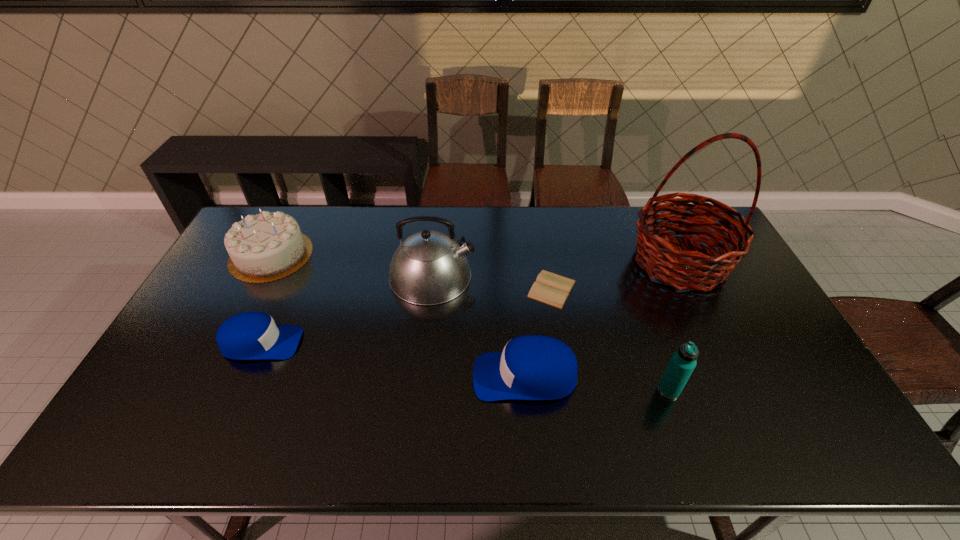
You are a GUI agent. You are given a task and a screenshot of the screen. Output one action in this format:
    pyautogui.click(x=<x>, y=<y>)
    Task: Click on the vacant space positioned 0.220m on the front-facing side of the fifth tallest object
    The height and width of the screenshot is (540, 960).
    Given the screenshot: What is the action you would take?
    390,376

Image resolution: width=960 pixels, height=540 pixels. Find the location of `free spot located 0.150m on the front-facing side of the fifth tallest object`. free spot located 0.150m on the front-facing side of the fifth tallest object is located at coordinates (417, 376).

I want to click on free space located on the front-facing side of the fifth tallest object, so click(382, 376).

Where is `blank space located on the handle side of the basket`? The width and height of the screenshot is (960, 540). blank space located on the handle side of the basket is located at coordinates (722, 350).

You are a GUI agent. You are given a task and a screenshot of the screen. Output one action in this format:
    pyautogui.click(x=<x>, y=<y>)
    Task: Click on the free space located from the spout of the sixth shortest object
    
    Given the screenshot: What is the action you would take?
    pyautogui.click(x=527, y=276)

Identify the location of free space located 0.380m on the right of the birthday cake. The width and height of the screenshot is (960, 540). (422, 255).

What are the coordinates of `free spot located 0.270m on the front of the shortest object` in the screenshot? It's located at (568, 388).

Where is `vacant space located 0.390m on the left of the water bottle`? vacant space located 0.390m on the left of the water bottle is located at coordinates (506, 390).

This screenshot has height=540, width=960. In order to click on basket at the far edge in this screenshot , I will do `click(683, 269)`.

Identify the location of birthday cake that is at the far edge. (268, 246).